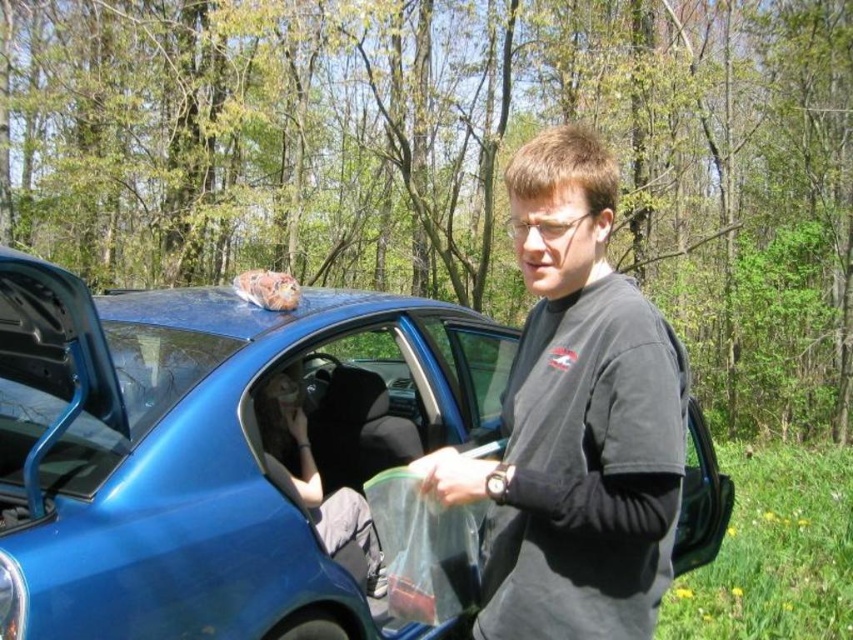
Question: Observing the image, what is the correct spatial positioning of blue metallic car at center in reference to black matte shirt at center?

Choices:
 (A) below
 (B) above

Answer: (A)

Question: Which of the following is the closest to the observer?

Choices:
 (A) blue metallic car at center
 (B) black matte shirt at center

Answer: (B)

Question: Does blue metallic car at center lie behind black matte shirt at center?

Choices:
 (A) yes
 (B) no

Answer: (A)

Question: Does blue metallic car at center have a smaller size compared to black matte shirt at center?

Choices:
 (A) no
 (B) yes

Answer: (A)